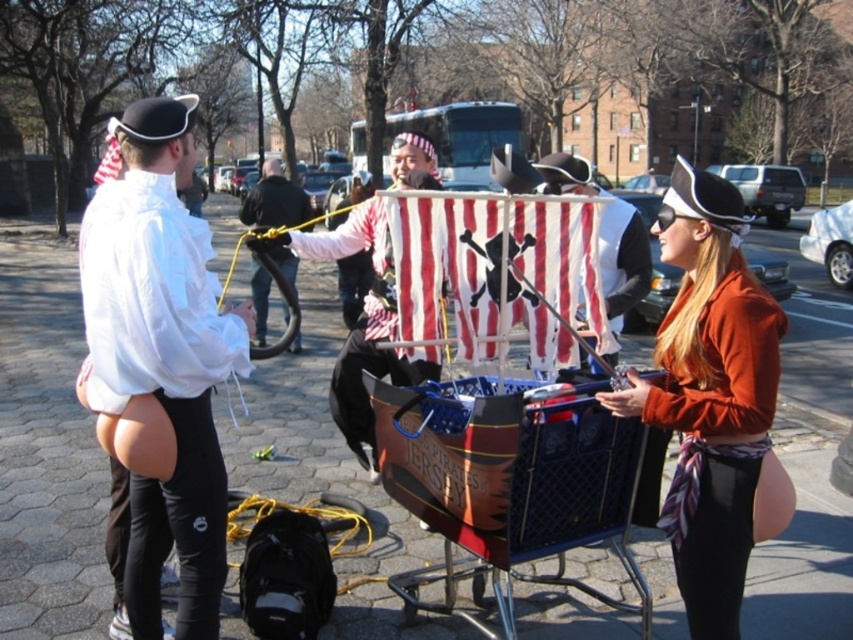
Between white matte shirt at left and black leather jacket at center, which one appears on the left side from the viewer's perspective?

black leather jacket at center

Can you confirm if white matte shirt at left is smaller than black leather jacket at center?

Yes.

Describe the element at coordinates (161, 384) in the screenshot. I see `white matte shirt at left` at that location.

Where is `white matte shirt at left`? The width and height of the screenshot is (853, 640). white matte shirt at left is located at coordinates (161, 384).

Is orange fleece jacket at center below matte white pirate hat at center?

Correct, orange fleece jacket at center is located below matte white pirate hat at center.

Is point (701, 384) in front of point (608, 248)?

Yes, it is in front of point (608, 248).

Locate an element on the screen. The width and height of the screenshot is (853, 640). orange fleece jacket at center is located at coordinates (712, 401).

Which is below, orange fleece jacket at center or striped fabric pirate hat at center?

Positioned lower is striped fabric pirate hat at center.

Who is more distant from viewer, (755, 413) or (351, 381)?

Point (351, 381)

Where is `orange fleece jacket at center`? The width and height of the screenshot is (853, 640). orange fleece jacket at center is located at coordinates (712, 401).